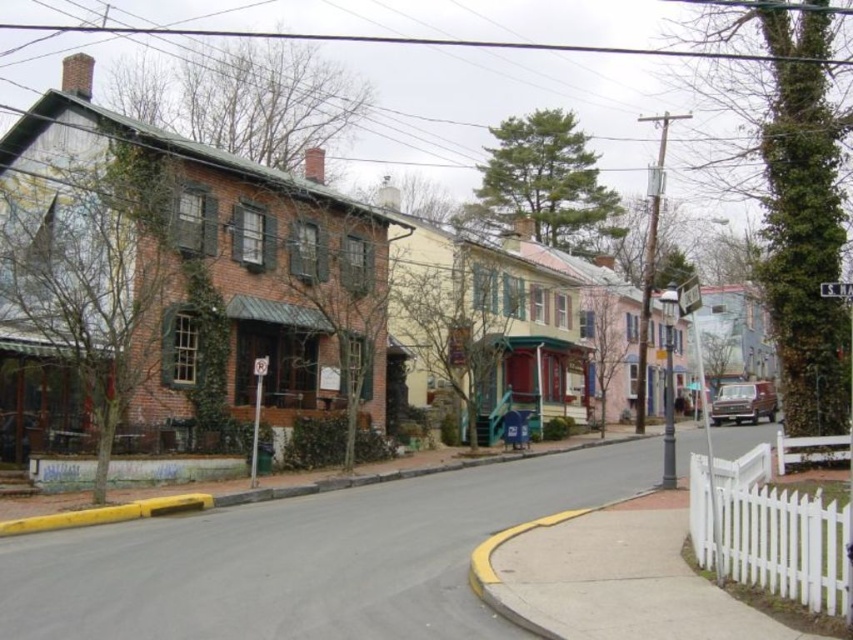
You are standing at the center of the street and want to visit the brick building at left. In which direction should you walk to reach it?

The brick building at left is located at point (300,250), which is to the left side of the street. Therefore, you should walk towards the left to reach it.

In the scene shown: You are a pedestrian standing on the sidewalk. You want to walk from the brick building at left to the yellow painted curb at lower left. Which direction should you move in?

Since the brick building at left is closer to you than the yellow painted curb at lower left, you should move forward towards the yellow painted curb at lower left to reach it.